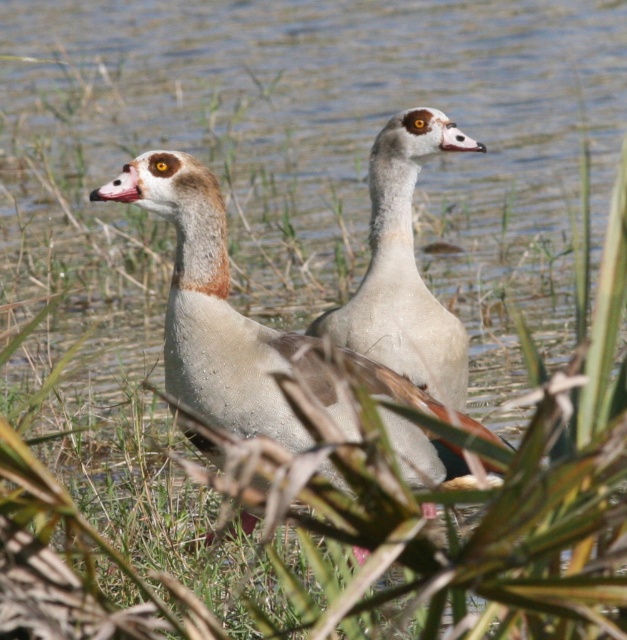
Is white matte duck at center to the right of white matte goose at center from the viewer's perspective?

Incorrect, white matte duck at center is not on the right side of white matte goose at center.

I want to click on white matte duck at center, so click(219, 314).

You are a GUI agent. You are given a task and a screenshot of the screen. Output one action in this format:
    pyautogui.click(x=<x>, y=<y>)
    Task: Click on the white matte duck at center
    The height and width of the screenshot is (640, 627).
    Given the screenshot: What is the action you would take?
    pyautogui.click(x=219, y=314)